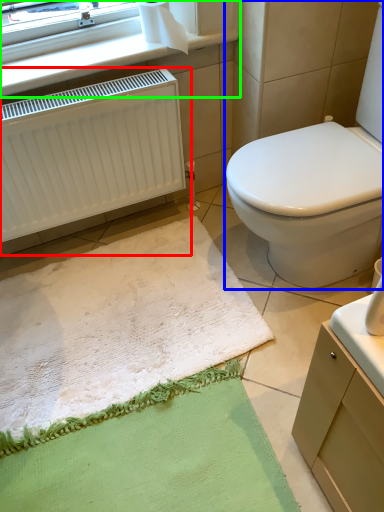
Question: Considering the real-world distances, which object is closest to radiator (highlighted by a red box)? toilet (highlighted by a blue box) or window frame (highlighted by a green box).

Choices:
 (A) toilet
 (B) window frame

Answer: (B)